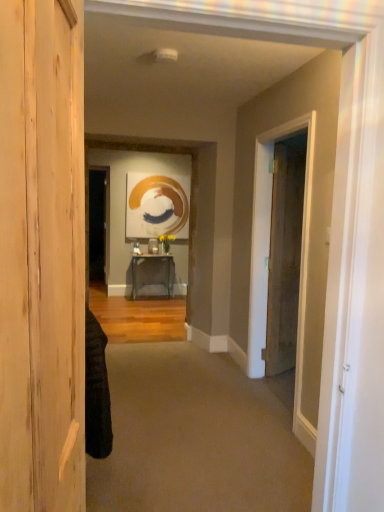
Question: Should I look upward or downward to see brown wood door at right, the 1th door positioned from the back?

Choices:
 (A) down
 (B) up

Answer: (A)

Question: Is brown wood door at right, which appears as the first door when viewed from the right, looking in the opposite direction of metallic gray table at center?

Choices:
 (A) yes
 (B) no

Answer: (B)

Question: Can you confirm if brown wood door at right, placed as the 2th door when sorted from left to right, is shorter than metallic gray table at center?

Choices:
 (A) yes
 (B) no

Answer: (B)

Question: Is brown wood door at right, the 1th door positioned from the back, smaller than metallic gray table at center?

Choices:
 (A) no
 (B) yes

Answer: (B)

Question: From a real-world perspective, is brown wood door at right, the 1th door positioned from the back, under metallic gray table at center?

Choices:
 (A) yes
 (B) no

Answer: (B)

Question: From the image's perspective, does brown wood door at right, placed as the 2th door when sorted from left to right, appear higher than metallic gray table at center?

Choices:
 (A) no
 (B) yes

Answer: (B)

Question: Could you tell me if brown wood door at right, the second door in the front-to-back sequence, is facing metallic gray table at center?

Choices:
 (A) no
 (B) yes

Answer: (A)

Question: Is brown wood door at right, the 1th door positioned from the back, far from carpet at center?

Choices:
 (A) yes
 (B) no

Answer: (A)

Question: Is brown wood door at right, the second door in the front-to-back sequence, taller than carpet at center?

Choices:
 (A) yes
 (B) no

Answer: (A)

Question: Does brown wood door at right, the second door in the front-to-back sequence, come behind carpet at center?

Choices:
 (A) yes
 (B) no

Answer: (A)

Question: Does brown wood door at right, the second door in the front-to-back sequence, contain carpet at center?

Choices:
 (A) yes
 (B) no

Answer: (B)

Question: Can you confirm if brown wood door at right, the 1th door positioned from the back, is bigger than carpet at center?

Choices:
 (A) no
 (B) yes

Answer: (A)

Question: From the image's perspective, would you say brown wood door at right, the second door in the front-to-back sequence, is positioned over carpet at center?

Choices:
 (A) yes
 (B) no

Answer: (A)

Question: Is brown wood door at right, the 1th door positioned from the back, completely or partially inside carpet at center?

Choices:
 (A) yes
 (B) no

Answer: (B)